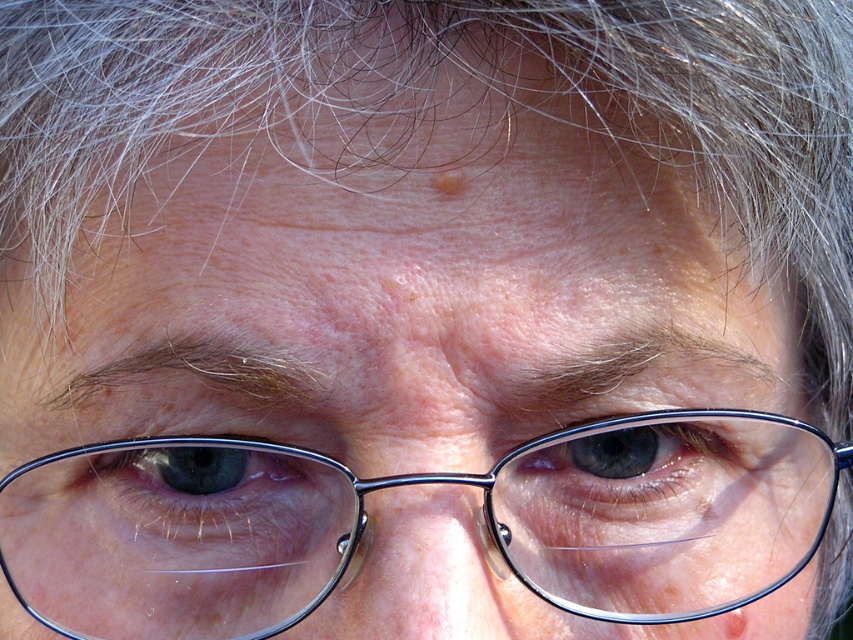
You are designing a new pair of glasses that need to fit over the existing metallic frame glasses at center and matte blue eye at center. Based on their sizes, will the new glasses be able to comfortably cover both objects without overlapping?

The metallic frame glasses at center is larger in size than the matte blue eye at center, so the new glasses should be designed to accommodate the larger size of the metallic frame glasses at center to ensure they can comfortably cover both objects without overlapping.

You are designing a pair of glasses for someone with two eyes of different sizes. The person has a matte metal eye at center and a matte blue eye at center. Which eye should you design the glasses to accommodate for a larger lens?

The matte metal eye at center has a larger width than the matte blue eye at center, so the glasses should be designed to accommodate the larger lens for the matte metal eye at center.

You are a photographer adjusting the focus on your camera. You want to ensure that the metallic frame glasses at center are sharp in the final photo. Given that the focus point is currently at coordinates 0.758, 0.481, is the glasses already in focus?

Yes, the metallic frame glasses at center are already in focus because the focus point is exactly at their position, which is at coordinates [409,484].